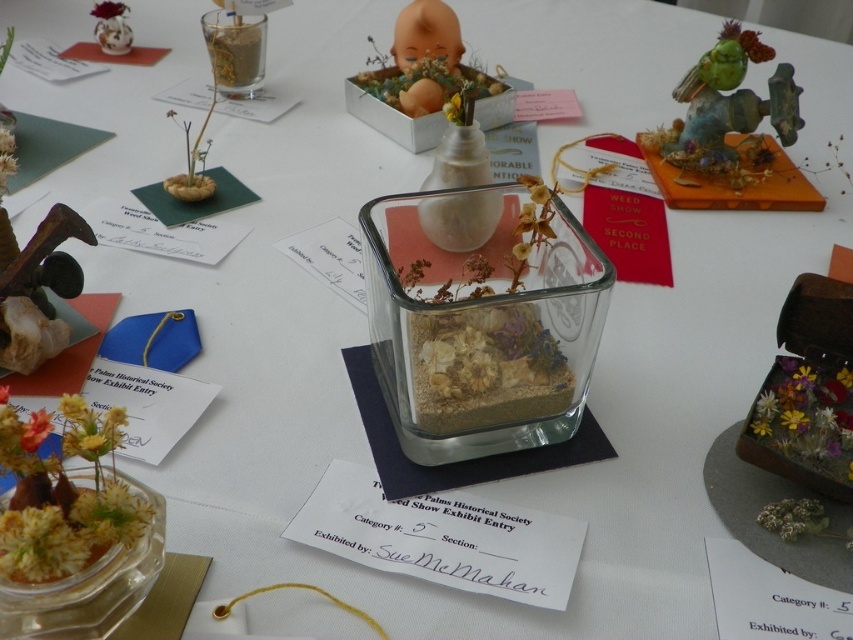
You are a judge at the Weed Show and need to determine which entry takes up more space on the display table. The entries are the green matte bird at upper right and the matte orange baby at center. Which one requires more space?

The matte orange baby at center requires more space because the green matte bird at upper right occupies less space than it.

You are a judge at the Weed Show and need to determine the spatial relationship between two points on the display table. Which point, point (732,160) or point (131,35), is closer to the camera?

Point (732,160) is closer to the camera than point (131,35).

You are a judge at the Weed Show and need to determine the placement of two entries. The entries are the matte orange baby at center and the matte white figurine at upper left. Based on their positions, which entry is positioned to the right of the other?

The matte orange baby at center is positioned to the right of the matte white figurine at upper left.